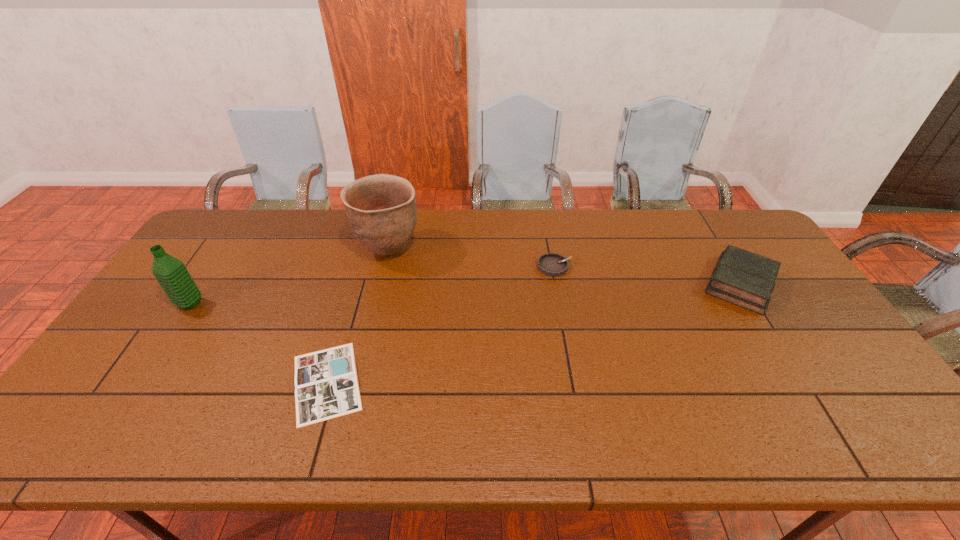
Identify the location of free space between the ashtray and the water bottle. (372, 285).

Where is `free spot between the water bottle and the second shortest object`? The height and width of the screenshot is (540, 960). free spot between the water bottle and the second shortest object is located at coordinates (372, 285).

The image size is (960, 540). Find the location of `vacant space that's between the shortest object and the third tallest object`. vacant space that's between the shortest object and the third tallest object is located at coordinates (534, 333).

I want to click on vacant area that lies between the leftmost object and the pottery, so click(x=290, y=277).

The image size is (960, 540). I want to click on unoccupied position between the pottery and the water bottle, so click(x=290, y=277).

Find the location of a particular element. This screenshot has height=540, width=960. vacant space that is in between the left book and the ashtray is located at coordinates (441, 325).

The height and width of the screenshot is (540, 960). I want to click on free space between the second shortest object and the water bottle, so click(x=372, y=285).

Locate an element on the screen. The image size is (960, 540). unoccupied area between the shortest object and the leftmost object is located at coordinates (258, 343).

This screenshot has width=960, height=540. Identify the location of unoccupied position between the ashtray and the nearest object. (441, 325).

Choose which object is the third nearest neighbor to the left book. Please provide its 2D coordinates. Your answer should be formatted as a tuple, i.e. [(x, y)], where the tuple contains the x and y coordinates of a point satisfying the conditions above.

[(552, 264)]